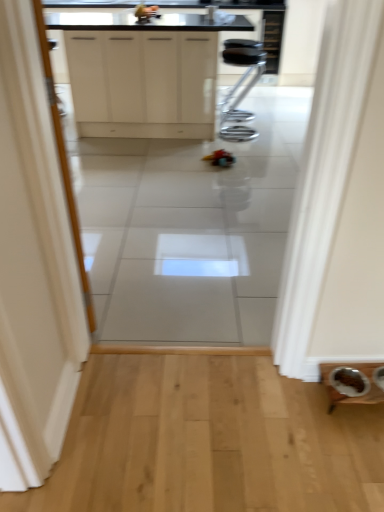
Question: Looking at their shapes, would you say black metal stool at center is wider or thinner than white matte cabinet at upper center?

Choices:
 (A) wide
 (B) thin

Answer: (B)

Question: From their relative heights in the image, would you say black metal stool at center is taller or shorter than white matte cabinet at upper center?

Choices:
 (A) short
 (B) tall

Answer: (A)

Question: Visually, is black metal stool at center positioned to the left or to the right of white matte cabinet at upper center?

Choices:
 (A) left
 (B) right

Answer: (B)

Question: Looking at their shapes, would you say white matte cabinet at upper center is wider or thinner than black metal stool at center?

Choices:
 (A) wide
 (B) thin

Answer: (A)

Question: Would you say white matte cabinet at upper center is inside or outside black metal stool at center?

Choices:
 (A) outside
 (B) inside

Answer: (A)

Question: Considering the positions of point (145, 102) and point (221, 115), is point (145, 102) closer or farther from the camera than point (221, 115)?

Choices:
 (A) closer
 (B) farther

Answer: (A)

Question: Relative to black metal stool at center, is white matte cabinet at upper center in front or behind?

Choices:
 (A) behind
 (B) front

Answer: (B)